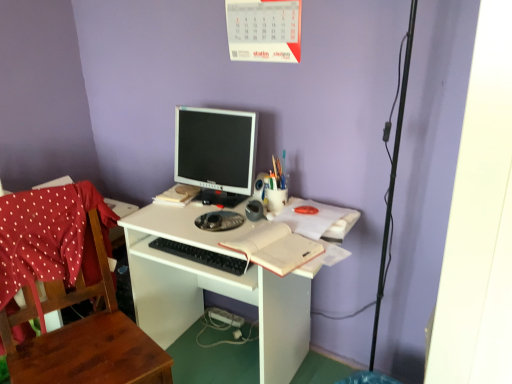
Question: Is wooden chair at left in contact with black plastic keyboard at center?

Choices:
 (A) no
 (B) yes

Answer: (A)

Question: Does wooden chair at left appear on the right side of black plastic keyboard at center?

Choices:
 (A) yes
 (B) no

Answer: (B)

Question: From a real-world perspective, is wooden chair at left under black plastic keyboard at center?

Choices:
 (A) no
 (B) yes

Answer: (B)

Question: Could you tell me if wooden chair at left is turned towards black plastic keyboard at center?

Choices:
 (A) yes
 (B) no

Answer: (B)

Question: Is wooden chair at left thinner than black plastic keyboard at center?

Choices:
 (A) yes
 (B) no

Answer: (B)

Question: Does wooden chair at left have a larger size compared to black plastic keyboard at center?

Choices:
 (A) no
 (B) yes

Answer: (B)

Question: From a real-world perspective, does multicolored plastic pen holder at center stand above matte black monitor at center?

Choices:
 (A) no
 (B) yes

Answer: (A)

Question: Does multicolored plastic pen holder at center appear on the right side of matte black monitor at center?

Choices:
 (A) no
 (B) yes

Answer: (B)

Question: Considering the relative sizes of multicolored plastic pen holder at center and matte black monitor at center in the image provided, is multicolored plastic pen holder at center taller than matte black monitor at center?

Choices:
 (A) yes
 (B) no

Answer: (B)

Question: Does multicolored plastic pen holder at center turn towards matte black monitor at center?

Choices:
 (A) yes
 (B) no

Answer: (B)

Question: Does multicolored plastic pen holder at center come behind matte black monitor at center?

Choices:
 (A) no
 (B) yes

Answer: (B)

Question: Is multicolored plastic pen holder at center closer to camera compared to matte black monitor at center?

Choices:
 (A) no
 (B) yes

Answer: (A)

Question: Does white matte notebook at center have a greater height compared to wooden chair at left?

Choices:
 (A) no
 (B) yes

Answer: (A)